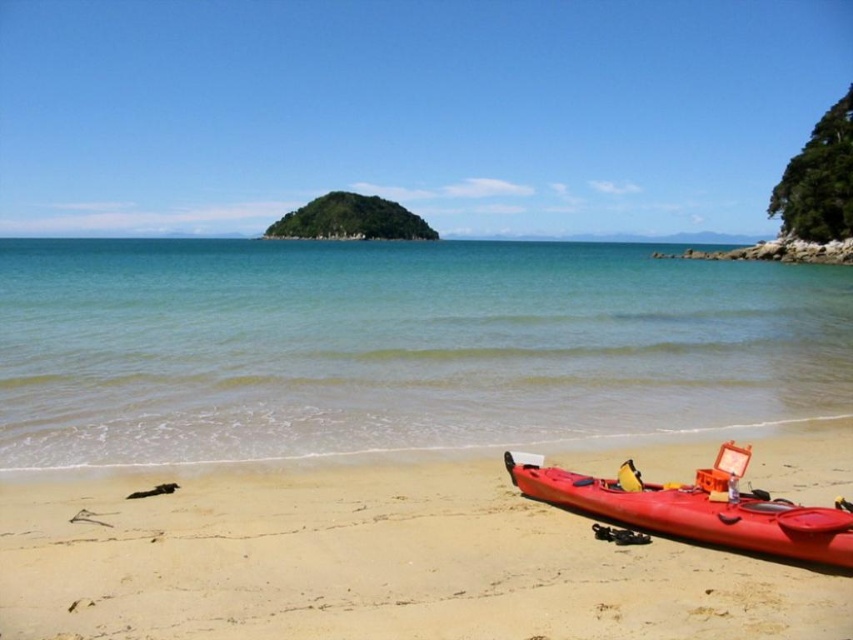
Question: Which object is positioned closest to the clear blue water at center?

Choices:
 (A) matte orange kayak at lower right
 (B) smooth sand at lower right

Answer: (A)

Question: Which point appears closest to the camera in this image?

Choices:
 (A) (347, 310)
 (B) (804, 508)
 (C) (467, 554)

Answer: (B)

Question: Which point is closer to the camera?

Choices:
 (A) (90, 452)
 (B) (722, 538)

Answer: (B)

Question: Does smooth sand at lower right have a larger size compared to matte orange kayak at lower right?

Choices:
 (A) no
 (B) yes

Answer: (A)

Question: Is clear blue water at center to the right of smooth sand at lower right from the viewer's perspective?

Choices:
 (A) yes
 (B) no

Answer: (B)

Question: Does clear blue water at center appear on the left side of matte orange kayak at lower right?

Choices:
 (A) yes
 (B) no

Answer: (A)